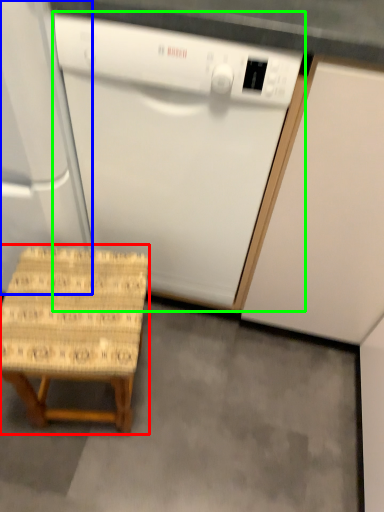
Question: Estimate the real-world distances between objects in this image. Which object is closer to stool (highlighted by a red box), appliance (highlighted by a blue box) or home appliance (highlighted by a green box)?

Choices:
 (A) appliance
 (B) home appliance

Answer: (A)